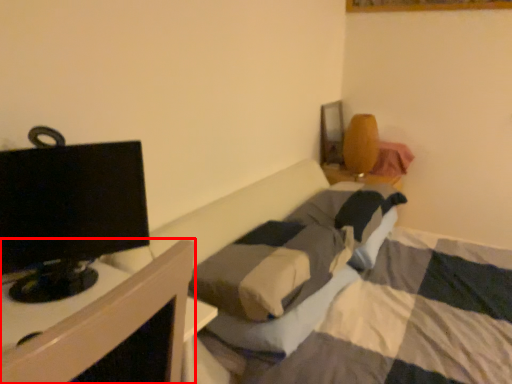
Question: From the image's perspective, considering the relative positions of furniture (annotated by the red box) and television in the image provided, where is furniture (annotated by the red box) located with respect to the staircase?

Choices:
 (A) above
 (B) below

Answer: (B)